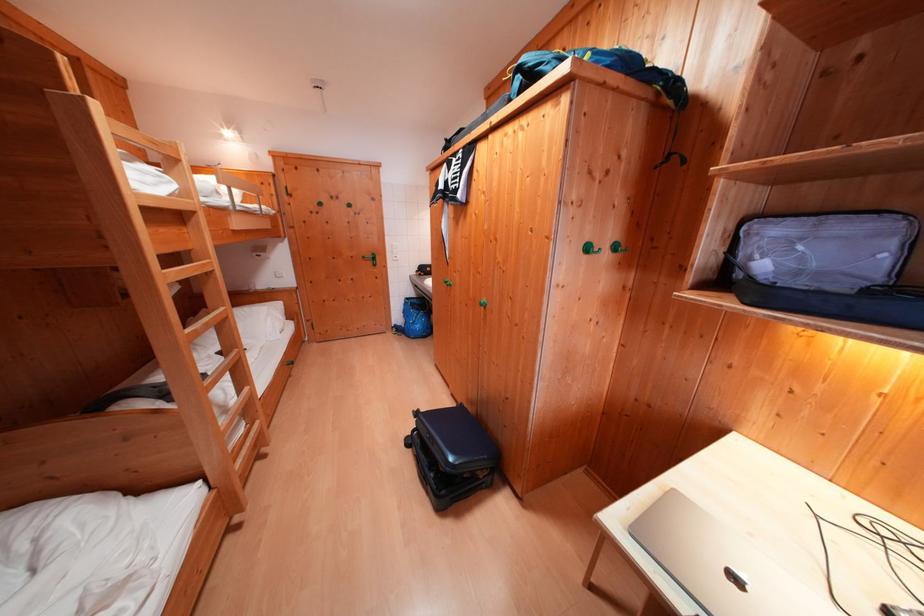
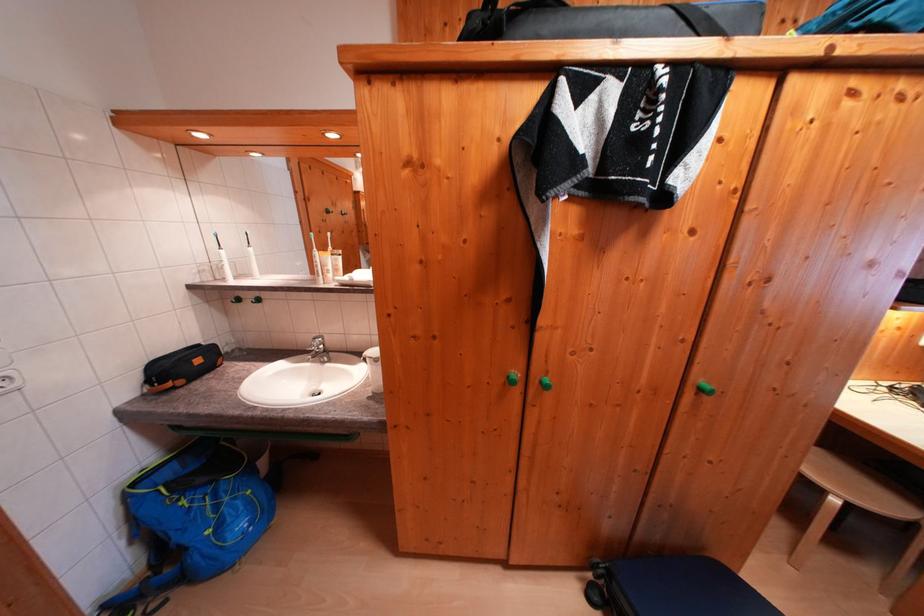
In the second image, find the point that corresponds to point 416,302 in the first image.

(142, 488)